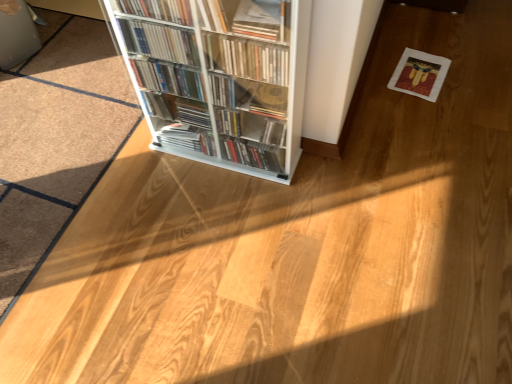
Where is `blank space to the left of white glossy bookcase at center`? blank space to the left of white glossy bookcase at center is located at coordinates (143, 184).